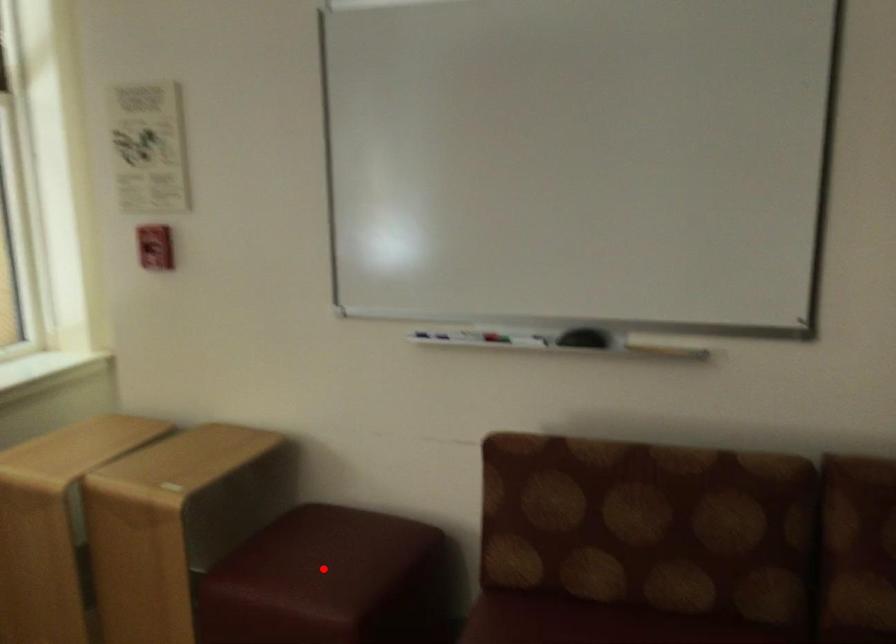
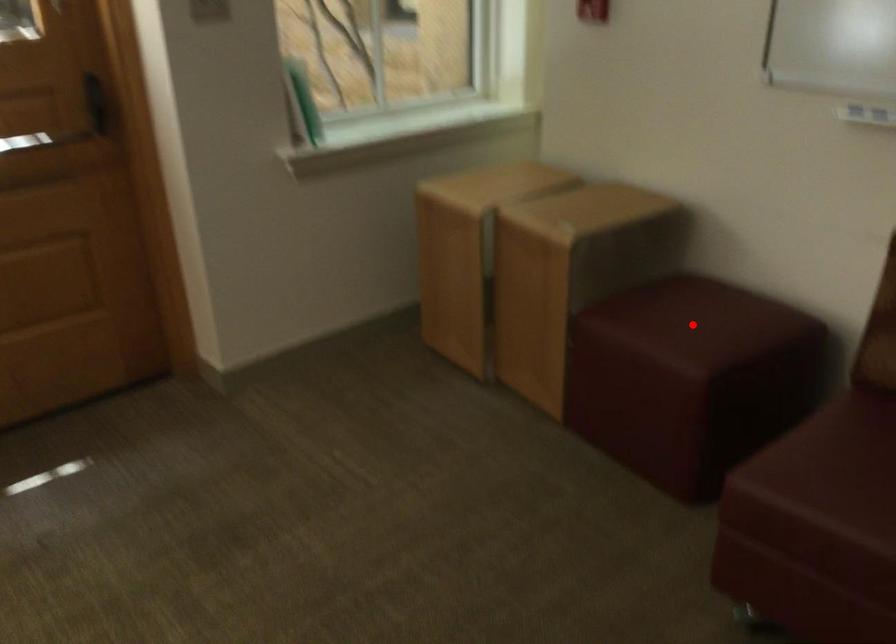
I am providing you with two images of the same scene from different viewpoints. A red point is marked on the first image and another point is marked on the second image. Are the points marked in image1 and image2 representing the same 3D position?

Yes